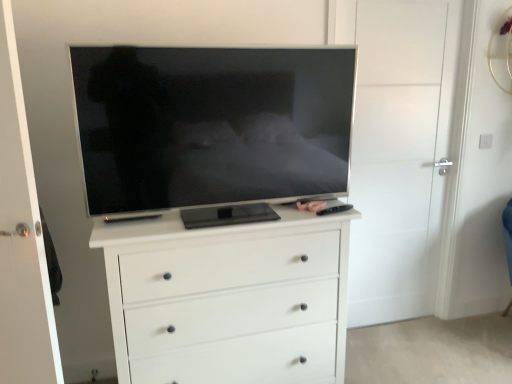
I want to click on vacant location below matte black tv at center (from a real-world perspective), so click(x=206, y=218).